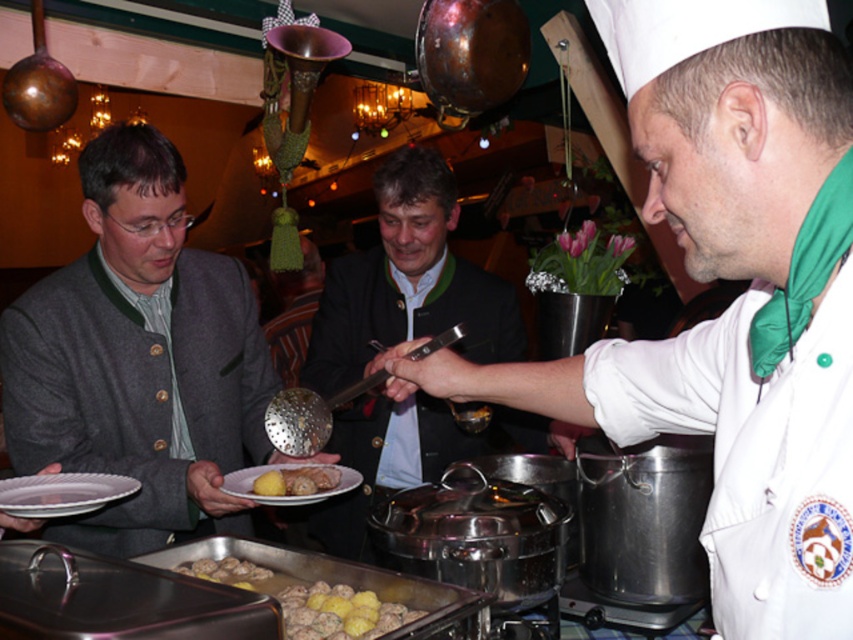
Question: Which of the following is the closest to the observer?

Choices:
 (A) brown matte meatballs at center
 (B) golden brown meatballs with yellow potatoes at center
 (C) white matte chef hat at upper center

Answer: (C)

Question: Which object is the closest to the white matte chef hat at upper center?

Choices:
 (A) gray woolen jacket at left
 (B) white matte plate at center
 (C) yellow matte potato at center
 (D) brown matte meatballs at center

Answer: (B)

Question: Is white matte chef hat at upper center thinner than white matte plate at center?

Choices:
 (A) no
 (B) yes

Answer: (A)

Question: Observing the image, what is the correct spatial positioning of white glossy plate at lower left in reference to white matte plate at center?

Choices:
 (A) left
 (B) right

Answer: (A)

Question: Is golden brown meatballs with yellow potatoes at center closer to the viewer compared to yellow matte potato at center?

Choices:
 (A) no
 (B) yes

Answer: (B)

Question: Among these objects, which one is nearest to the camera?

Choices:
 (A) white matte chef hat at upper center
 (B) white glossy plate at lower left
 (C) brown matte meatballs at center

Answer: (A)